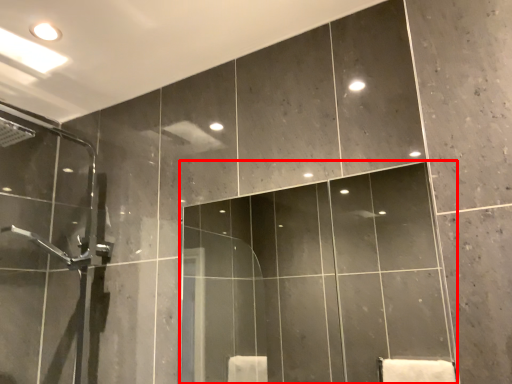
Question: From the image's perspective, what is the correct spatial positioning of mirror (annotated by the red box) in reference to screen door?

Choices:
 (A) above
 (B) below

Answer: (B)